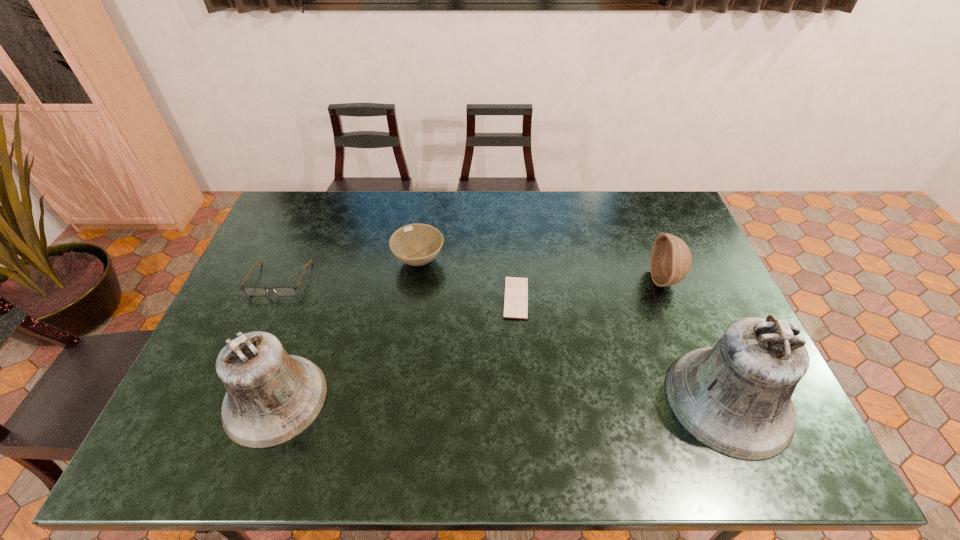
Identify the location of free spot between the second shortest object and the fourth object from right to left. (349, 269).

Where is `free space between the shortest object and the fifth shortest object`? free space between the shortest object and the fifth shortest object is located at coordinates (396, 348).

Where is `free space between the left bell and the shorter bowl`? The width and height of the screenshot is (960, 540). free space between the left bell and the shorter bowl is located at coordinates (348, 330).

Identify the location of free space between the third object from left to right and the right bowl. (542, 271).

Find the location of a particular element. The image size is (960, 540). vacant area between the diary and the shorter bowl is located at coordinates (468, 279).

At what (x,y) coordinates should I click in order to perform the action: click on free space between the left bowl and the second shortest object. Please return your answer as a coordinate pair (x, y). The width and height of the screenshot is (960, 540). Looking at the image, I should click on (349, 269).

Identify which object is the third nearest to the shorter bell. Please provide its 2D coordinates. Your answer should be formatted as a tuple, i.e. [(x, y)], where the tuple contains the x and y coordinates of a point satisfying the conditions above.

[(516, 288)]

Select which object is the fifth closest to the left bell. Please provide its 2D coordinates. Your answer should be formatted as a tuple, i.e. [(x, y)], where the tuple contains the x and y coordinates of a point satisfying the conditions above.

[(671, 259)]

This screenshot has height=540, width=960. Find the location of `vacant position in the image that satisfies the following two spatial constraints: 1. on the front-facing side of the right bell; 2. on the left side of the spectacles`. vacant position in the image that satisfies the following two spatial constraints: 1. on the front-facing side of the right bell; 2. on the left side of the spectacles is located at coordinates (227, 400).

This screenshot has width=960, height=540. In order to click on blank space that satisfies the following two spatial constraints: 1. on the front-facing side of the spectacles; 2. on the left side of the left bell in this screenshot , I will do `click(227, 399)`.